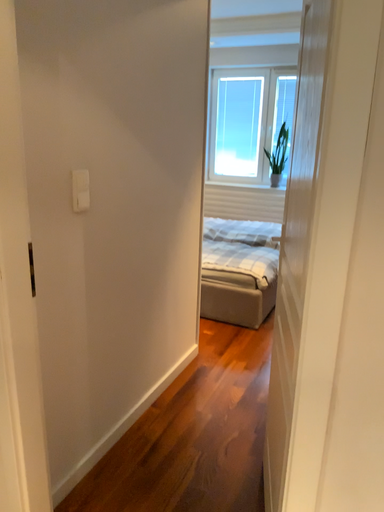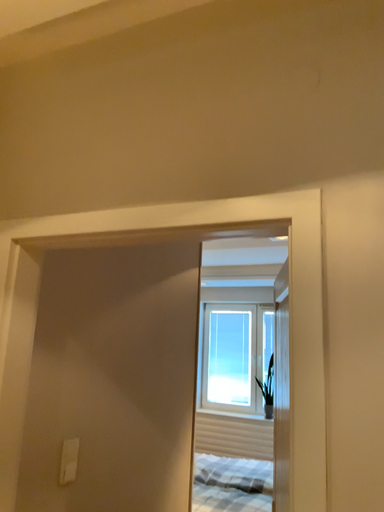
Question: Which way did the camera rotate in the video?

Choices:
 (A) rotated upward
 (B) rotated downward

Answer: (A)